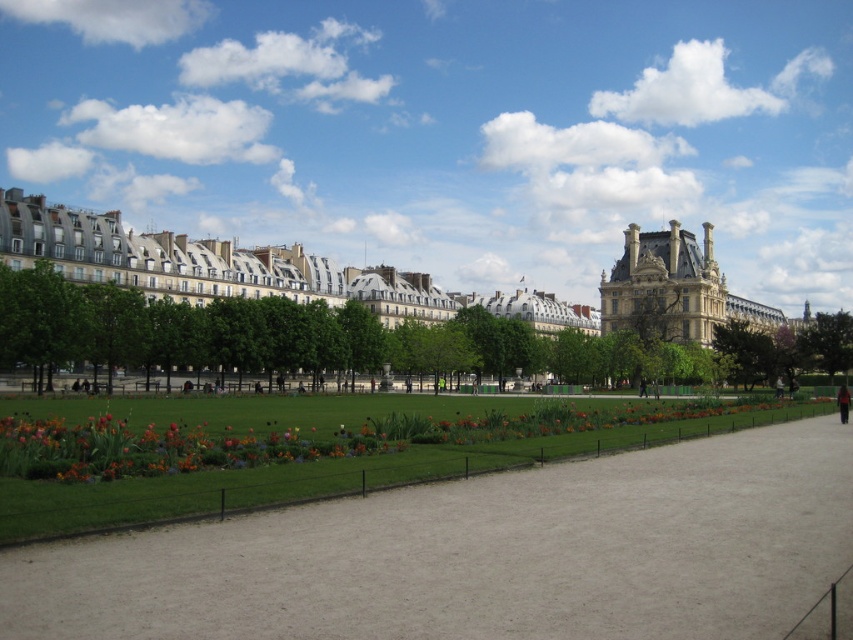
Does green grass at center have a greater width compared to green leafy tree at left?

Correct, the width of green grass at center exceeds that of green leafy tree at left.

Does green grass at center appear under green leafy tree at left?

Correct, green grass at center is located below green leafy tree at left.

Is point (495, 614) in front of point (67, 305)?

Yes, it is.

Where is `green grass at center`? green grass at center is located at coordinates (482, 556).

Does stone/brick palace at upper center have a lesser width compared to green leafy tree at left?

In fact, stone/brick palace at upper center might be wider than green leafy tree at left.

Between stone/brick palace at upper center and green leafy tree at left, which one appears on the left side from the viewer's perspective?

From the viewer's perspective, green leafy tree at left appears more on the left side.

Between point (82, 260) and point (39, 344), which one is positioned in front?

Positioned in front is point (39, 344).

You are a GUI agent. You are given a task and a screenshot of the screen. Output one action in this format:
    pyautogui.click(x=<x>, y=<y>)
    Task: Click on the stone/brick palace at upper center
    This screenshot has height=640, width=853.
    Given the screenshot: What is the action you would take?
    pyautogui.click(x=242, y=269)

Is point (636, 291) positioned behind point (827, 314)?

No.

Is stone/brick palace at upper right bigger than green leafy tree at right?

Correct, stone/brick palace at upper right is larger in size than green leafy tree at right.

This screenshot has height=640, width=853. What are the coordinates of `stone/brick palace at upper right` in the screenshot? It's located at (675, 289).